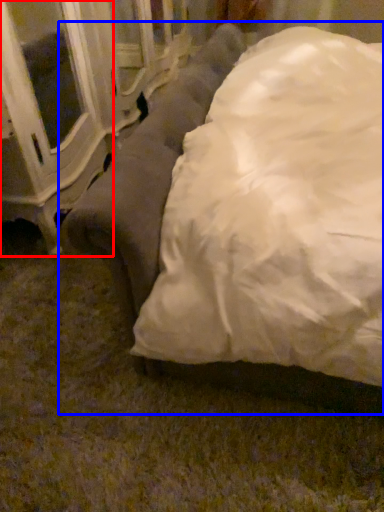
Question: Which object is further to the camera taking this photo, furniture (highlighted by a red box) or studio couch (highlighted by a blue box)?

Choices:
 (A) furniture
 (B) studio couch

Answer: (A)